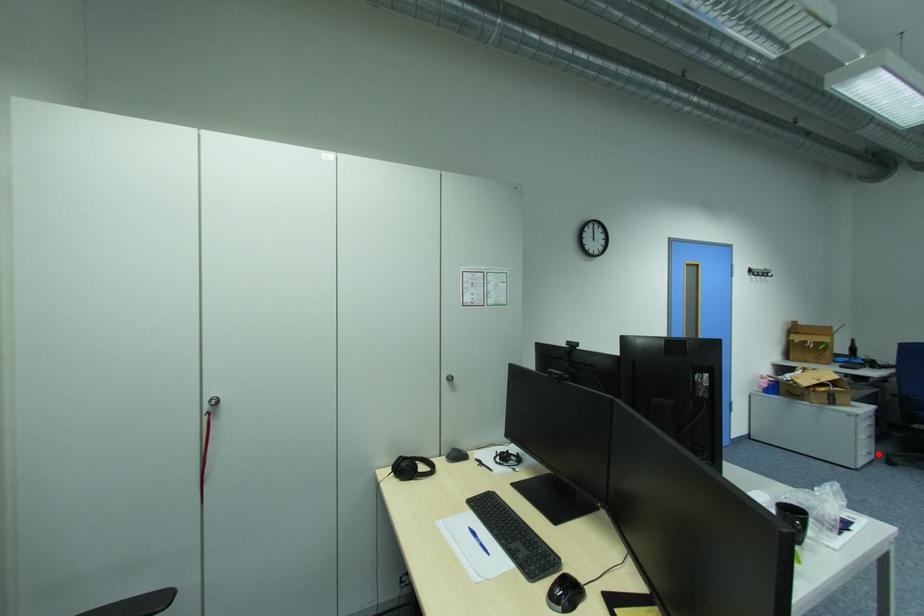
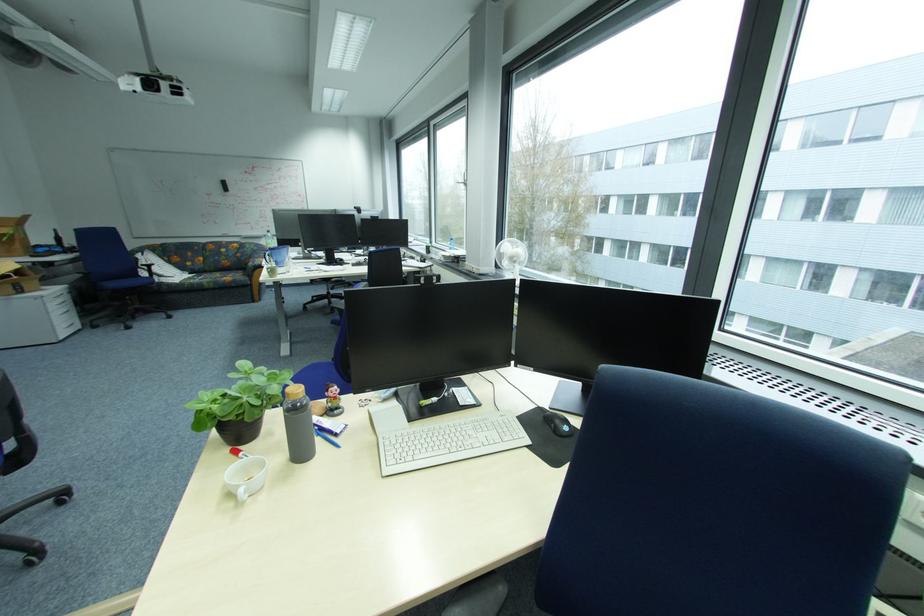
Question: I am providing you with two images of the same scene from different viewpoints. Image1 has a red point marked. In image2, the corresponding 3D location appears at what relative position? Reply with the corresponding letter.

Choices:
 (A) Closer
 (B) Farther

Answer: (B)